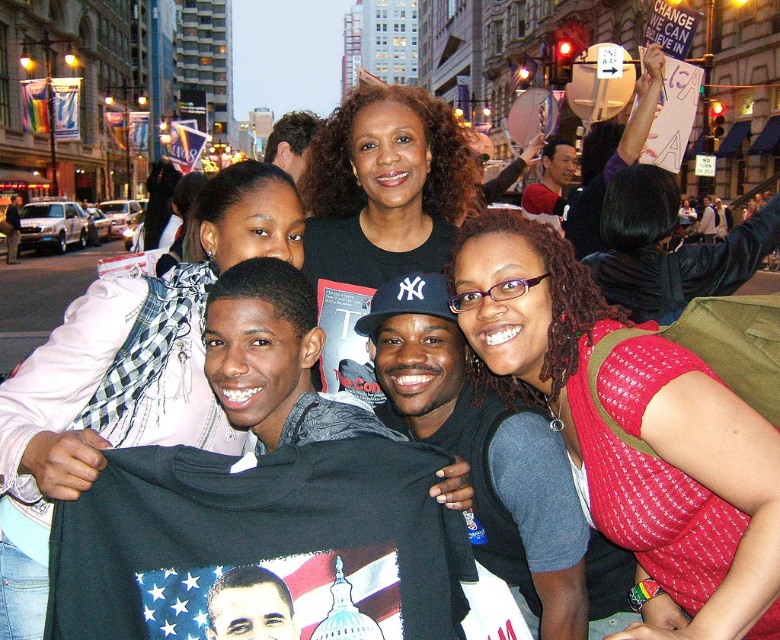
Question: Among these objects, which one is farthest from the camera?

Choices:
 (A) red quilted vest at center
 (B) white scarf at upper left

Answer: (A)

Question: Does white scarf at upper left have a smaller size compared to black matte t-shirt at center?

Choices:
 (A) no
 (B) yes

Answer: (A)

Question: Does white scarf at upper left appear on the right side of black matte t-shirt at center?

Choices:
 (A) no
 (B) yes

Answer: (A)

Question: Among these points, which one is farthest from the camera?

Choices:
 (A) (144, 394)
 (B) (388, 129)

Answer: (B)

Question: Which point is closer to the camera taking this photo?

Choices:
 (A) (644, 428)
 (B) (337, 144)

Answer: (A)

Question: From the image, what is the correct spatial relationship of red quilted vest at center in relation to white scarf at upper left?

Choices:
 (A) below
 (B) above

Answer: (A)